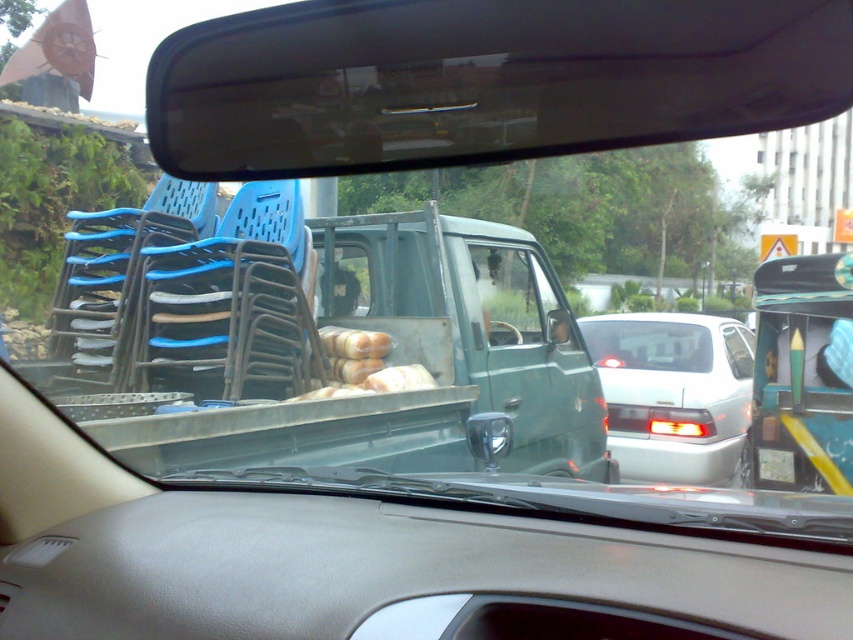
Question: Among these objects, which one is farthest from the camera?

Choices:
 (A) white plastic license plate at center
 (B) green matte truck at center
 (C) silver metallic sedan at center

Answer: (C)

Question: In this image, where is metallic blue truck at center located relative to green matte truck at center?

Choices:
 (A) below
 (B) above

Answer: (A)

Question: Which object appears closest to the camera in this image?

Choices:
 (A) green matte truck at center
 (B) white plastic license plate at center
 (C) metallic blue truck at center
 (D) gray leather dashboard at center

Answer: (D)

Question: Which point is closer to the camera?

Choices:
 (A) (498, 435)
 (B) (759, 484)

Answer: (A)

Question: Does green matte truck at center have a smaller size compared to white plastic license plate at center?

Choices:
 (A) yes
 (B) no

Answer: (B)

Question: Does gray leather dashboard at center appear on the right side of clear plastic mirror at center?

Choices:
 (A) no
 (B) yes

Answer: (A)